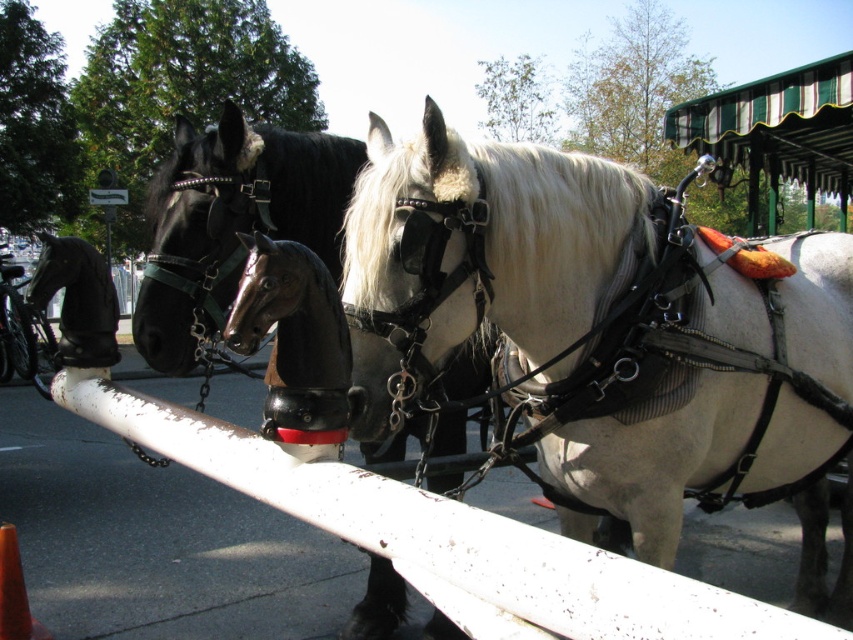
You are a photographer standing at a certain position. You want to take a photo of the shiny black horse at center. If your camera has a focal length of 50mm and you want the horse to fill the frame, would you need to move closer or farther away? Assume the horse is 6 feet tall and your camera sensor is 24x36mm.

To determine whether to move closer or farther, calculate the required distance. Using the formula distance_to_subject_in_mm divided by focal_length equals sensor_size divided by subject_height_in_mm. Plugging in values, distance divided by 50mm equals 36mm divided by 600mm. Solving gives distance equals 300mm or 0.98 meters. Since the current distance is 8.28 feet which is about 2525mm, you need to move much closer to fill the frame.

You are a tourist standing in front of the green and white striped canopy structure. You want to take a photo of both the shiny black horse at center and the shiny black horse at left. Which horse should you position closer to the canopy structure to include both in your photo?

You should position the shiny black horse at left closer to the canopy structure because it is behind the shiny black horse at center, so moving it forward will help both horses fit into the photo frame.

You are a photographer trying to capture a photo of the horses. You want to ensure both the white glossy horse at center and the shiny black horse at left are clearly visible in your frame. Given that your camera has a limited zoom range, which horse should you focus on to ensure both are in focus without moving the camera?

Answer: You should focus on the shiny black horse at left because the white glossy horse at center is bigger, so focusing on the closer horse will keep both in focus.